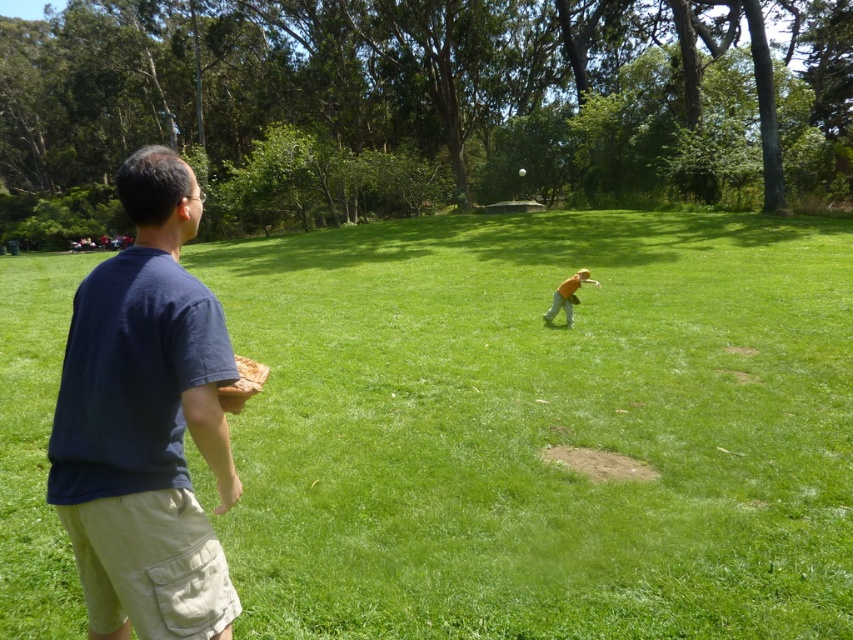
You are standing in the park and see two points marked in the image. Which point is closer to you, point (827, 358) or point (577, 298)?

Point (827, 358) is closer to the viewer than point (577, 298).

Looking at this image, you are standing at the point marked by coordinates point [144,422]. Looking around, you see two people playing catch. The person in the dark blue t shirt at left is behind you. The other person is wearing a bright orange shirt. Which direction should you face to see the person in the bright orange shirt?

Since the dark blue t shirt at left is behind you, facing away from them would direct you towards the bright orange shirt. Therefore, you should turn around or face the opposite direction to see the person in the bright orange shirt.

You are standing at the edge of the green grassy field at center and want to throw a ball to the brown leather glove at center. Which direction should you aim to hit the target?

The green grassy field at center is positioned on the left side of the brown leather glove at center, so you should aim to the right to hit the target.